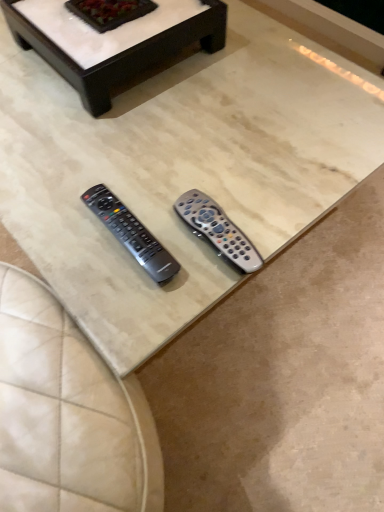
The image size is (384, 512). I want to click on vacant area that is in front of translucent gray remote at center, positioned as the 2th remote control in left-to-right order, so click(x=180, y=302).